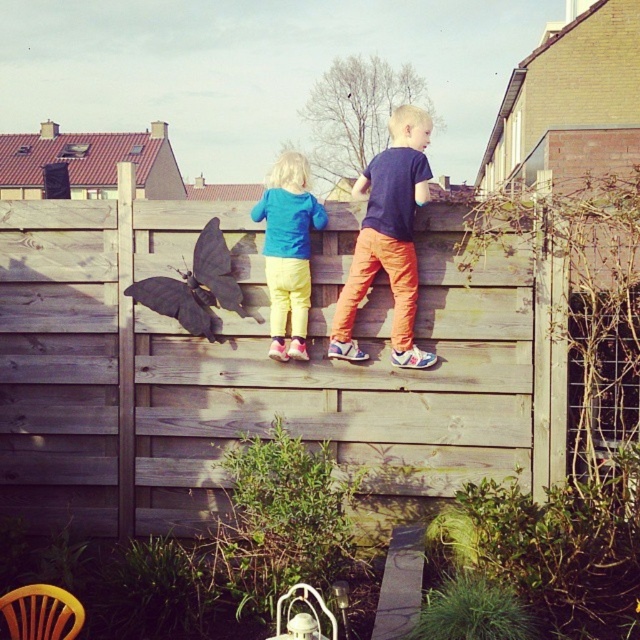
Measure the distance between wooden fence at center and orange cotton pants at center.

They are 1.05 meters apart.

Consider the image. Is wooden fence at center closer to the viewer compared to orange cotton pants at center?

No, it is not.

Locate an element on the screen. wooden fence at center is located at coordinates (241, 368).

The width and height of the screenshot is (640, 640). I want to click on wooden fence at center, so click(241, 368).

Who is taller, wooden fence at center or matte blue hoodie at upper center?

wooden fence at center

Based on the photo, does wooden fence at center have a larger size compared to matte blue hoodie at upper center?

Indeed, wooden fence at center has a larger size compared to matte blue hoodie at upper center.

Does point (346, 227) come in front of point (289, 236)?

No.

Find the location of a particular element. wooden fence at center is located at coordinates (241, 368).

What do you see at coordinates (388, 240) in the screenshot?
I see `orange cotton pants at center` at bounding box center [388, 240].

Can you confirm if orange cotton pants at center is positioned to the left of matte blue hoodie at upper center?

Incorrect, orange cotton pants at center is not on the left side of matte blue hoodie at upper center.

Who is more distant from viewer, (416,193) or (273,328)?

Positioned behind is point (273,328).

The width and height of the screenshot is (640, 640). I want to click on orange cotton pants at center, so click(x=388, y=240).